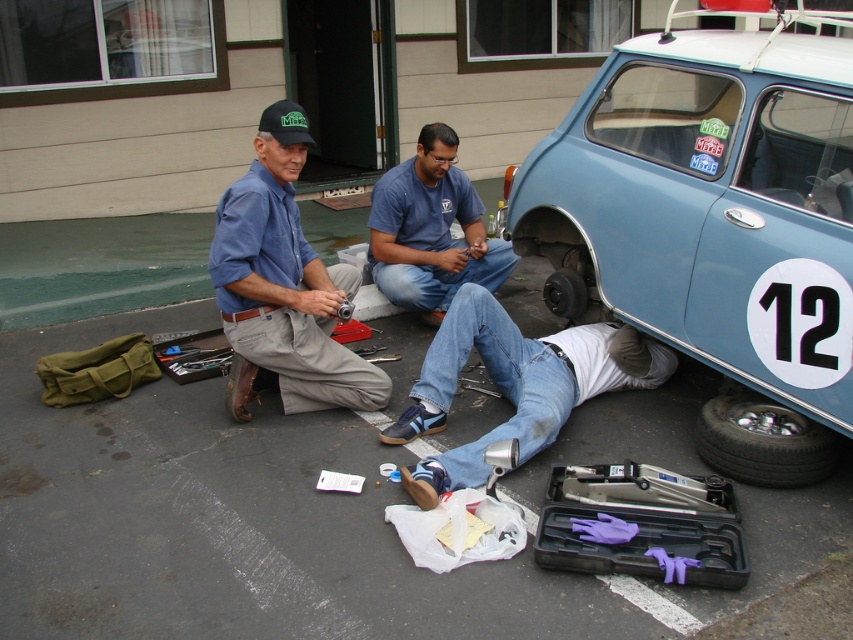
You are a maintenance worker standing at the entrance of the driveway. You need to move a heavy tool box from your current position to the light blue metallic car at lower right. The tool box is 1.8 meters long. Can you carry it horizontally without bending it? Explain your reasoning.

The distance of light blue metallic car at lower right from viewer is 2.78 meters. Since the tool box is 1.8 meters long, which is shorter than the distance to the car, you can carry it horizontally without bending it.